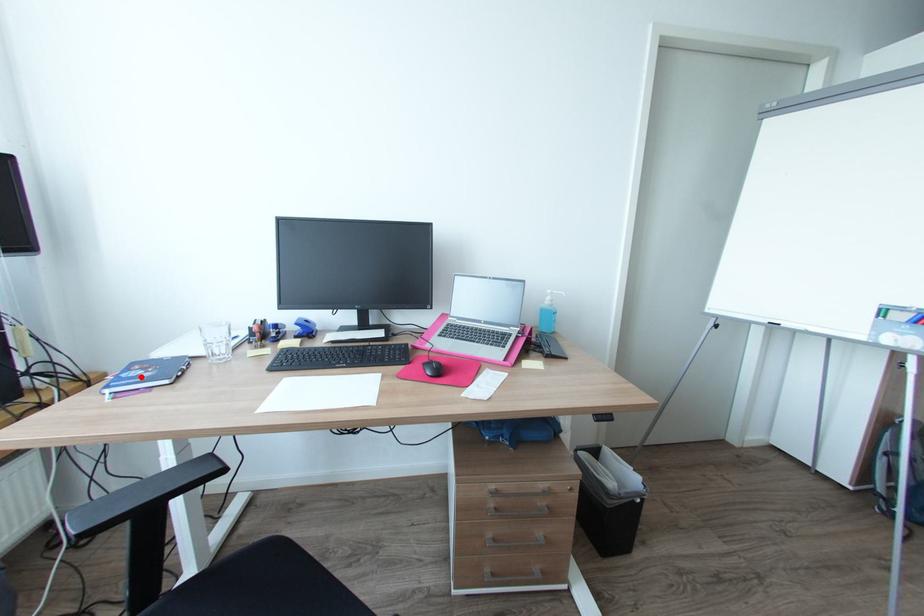
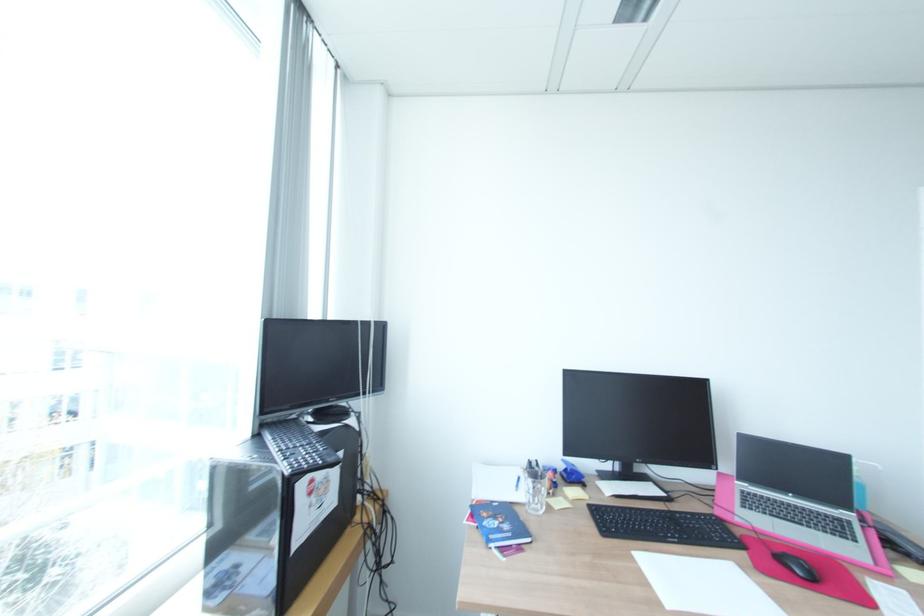
In the second image, find the point that corresponds to the highlighted location in the first image.

(504, 530)